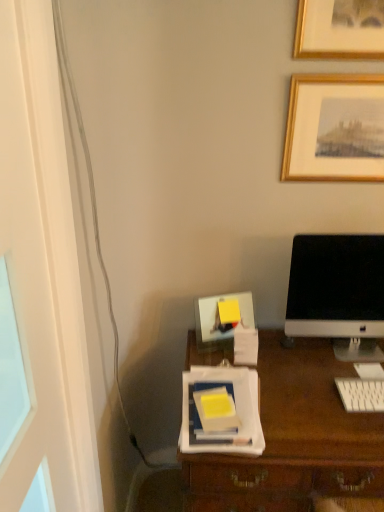
Question: Is white plastic keyboard at lower right located within transparent glass door at left?

Choices:
 (A) yes
 (B) no

Answer: (B)

Question: From the image's perspective, does transparent glass door at left appear higher than white plastic keyboard at lower right?

Choices:
 (A) yes
 (B) no

Answer: (A)

Question: Can you confirm if transparent glass door at left is thinner than white plastic keyboard at lower right?

Choices:
 (A) yes
 (B) no

Answer: (A)

Question: Can you confirm if transparent glass door at left is bigger than white plastic keyboard at lower right?

Choices:
 (A) no
 (B) yes

Answer: (B)

Question: Is transparent glass door at left closer to camera compared to white plastic keyboard at lower right?

Choices:
 (A) no
 (B) yes

Answer: (B)

Question: Is transparent glass door at left looking in the opposite direction of white plastic keyboard at lower right?

Choices:
 (A) no
 (B) yes

Answer: (A)

Question: From the image's perspective, does gold wooden picture frame at upper right appear higher than transparent glass door at left?

Choices:
 (A) yes
 (B) no

Answer: (A)

Question: Is gold wooden picture frame at upper right beside transparent glass door at left?

Choices:
 (A) yes
 (B) no

Answer: (B)

Question: Does gold wooden picture frame at upper right have a greater height compared to transparent glass door at left?

Choices:
 (A) no
 (B) yes

Answer: (A)

Question: From the image's perspective, is gold wooden picture frame at upper right beneath transparent glass door at left?

Choices:
 (A) yes
 (B) no

Answer: (B)

Question: Does gold wooden picture frame at upper right turn towards transparent glass door at left?

Choices:
 (A) no
 (B) yes

Answer: (A)

Question: Is gold wooden picture frame at upper right in front of transparent glass door at left?

Choices:
 (A) no
 (B) yes

Answer: (A)

Question: From the image's perspective, is white glossy computer monitor at right above yellow matte notebook at center?

Choices:
 (A) yes
 (B) no

Answer: (A)